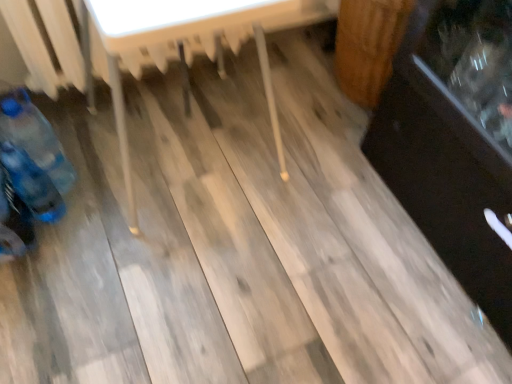
Find the location of a particular element. The height and width of the screenshot is (384, 512). free point behind blue plastic bottle at lower left, positioned as the 2th bottle in top-to-bottom order is located at coordinates (89, 173).